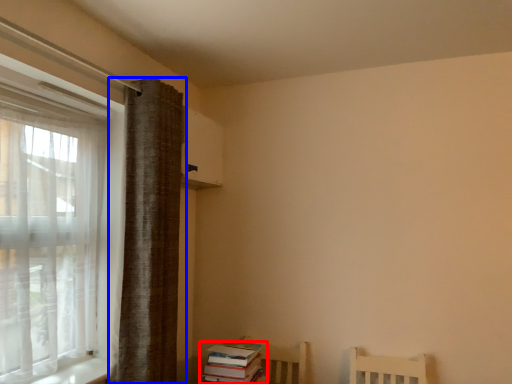
Question: Which point is closer to the camera, book (highlighted by a red box) or curtain (highlighted by a blue box)?

Choices:
 (A) book
 (B) curtain

Answer: (B)